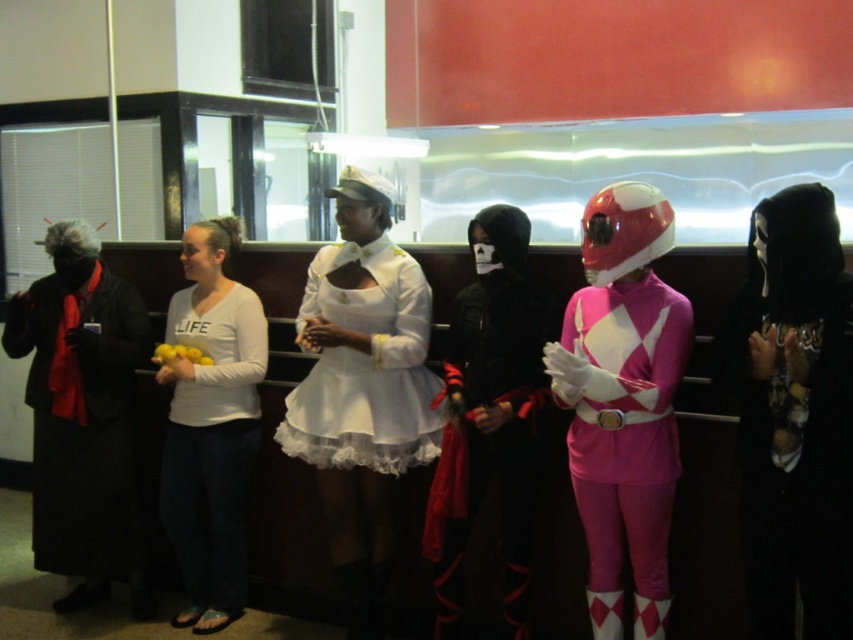
Question: Does black velvet mask at center come in front of white satin dress at center?

Choices:
 (A) yes
 (B) no

Answer: (A)

Question: Which point appears farthest from the camera in this image?

Choices:
 (A) (9, 321)
 (B) (212, 586)
 (C) (838, 252)
 (D) (508, 340)

Answer: (B)

Question: Can you confirm if matte black costume at center is thinner than white cotton shirt at center?

Choices:
 (A) yes
 (B) no

Answer: (A)

Question: Which object appears farthest from the camera in this image?

Choices:
 (A) black matte coat at left
 (B) matte black costume at center
 (C) white satin dress at center
 (D) white cotton shirt at center

Answer: (A)

Question: Among these points, which one is nearest to the camera?

Choices:
 (A) (643, 276)
 (B) (519, 609)
 (C) (256, 381)

Answer: (A)

Question: Is black velvet mask at center positioned at the back of matte black costume at center?

Choices:
 (A) no
 (B) yes

Answer: (A)